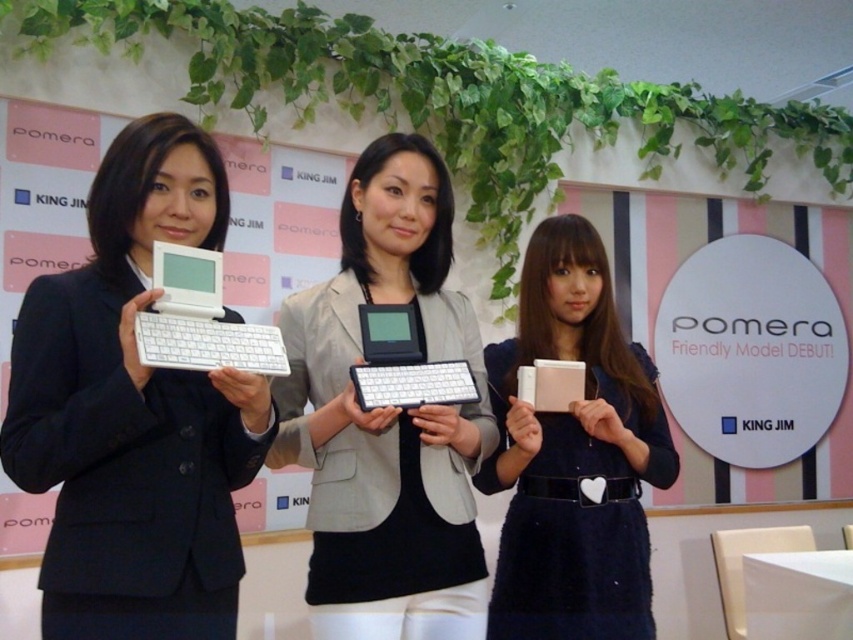
Question: Which object is positioned farthest from the matte black keyboard at center?

Choices:
 (A) white matte tablet at center
 (B) pink fabric purse at center
 (C) matte black device at center
 (D) matte black laptop at left

Answer: (B)

Question: In this image, where is pink fabric purse at center located relative to white matte tablet at center?

Choices:
 (A) above
 (B) below

Answer: (B)

Question: Estimate the real-world distances between objects in this image. Which object is farther from the white matte laptop at left?

Choices:
 (A) matte black device at center
 (B) matte black laptop at left
 (C) white matte tablet at center
 (D) pink fabric purse at center

Answer: (D)

Question: Can you confirm if white matte laptop at left is bigger than matte black keyboard at center?

Choices:
 (A) no
 (B) yes

Answer: (B)

Question: Which point is closer to the camera?

Choices:
 (A) matte black device at center
 (B) matte black keyboard at center

Answer: (B)

Question: Is the position of matte black device at center more distant than that of pink fabric purse at center?

Choices:
 (A) yes
 (B) no

Answer: (B)